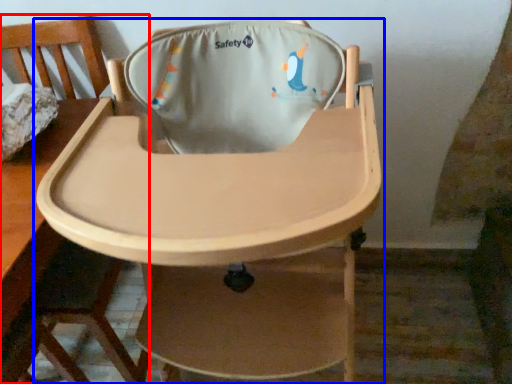
Question: Which object appears farthest to the camera in this image, chair (highlighted by a red box) or chair (highlighted by a blue box)?

Choices:
 (A) chair
 (B) chair

Answer: (A)